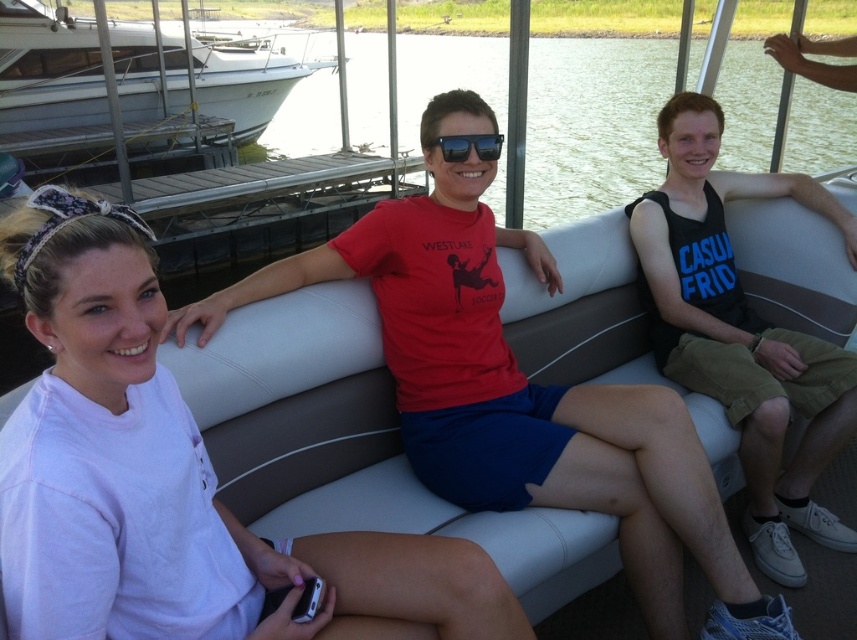
Measure the distance between black tank top at right and sunglasses at center.

The distance of black tank top at right from sunglasses at center is 4.00 feet.

Is black tank top at right taller than sunglasses at center?

Yes.

In order to click on black tank top at right in this screenshot , I will do `click(742, 332)`.

At what (x,y) coordinates should I click in order to perform the action: click on black tank top at right. Please return your answer as a coordinate pair (x, y). Looking at the image, I should click on (742, 332).

Between white glossy boat at left and sunglasses at center, which one has less height?

sunglasses at center

Image resolution: width=857 pixels, height=640 pixels. What do you see at coordinates (48, 70) in the screenshot?
I see `white glossy boat at left` at bounding box center [48, 70].

What do you see at coordinates (48, 70) in the screenshot? The image size is (857, 640). I see `white glossy boat at left` at bounding box center [48, 70].

Find the location of a particular element. This screenshot has height=640, width=857. white glossy boat at left is located at coordinates (48, 70).

Is matte red t-shirt at center to the right of sunglasses at center from the viewer's perspective?

Yes, matte red t-shirt at center is to the right of sunglasses at center.

Is the position of matte red t-shirt at center less distant than that of sunglasses at center?

Yes, it is in front of sunglasses at center.

You are a GUI agent. You are given a task and a screenshot of the screen. Output one action in this format:
    pyautogui.click(x=<x>, y=<y>)
    Task: Click on the matte red t-shirt at center
    
    Given the screenshot: What is the action you would take?
    pyautogui.click(x=520, y=401)

Identify the location of matte red t-shirt at center. The width and height of the screenshot is (857, 640). (520, 401).